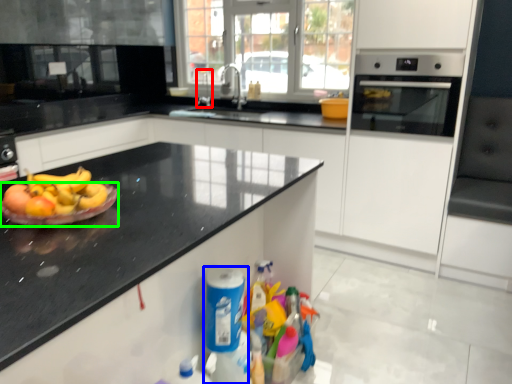
Question: Which object is positioned farthest from faucet (highlighted by a red box)? Select from cleaning product (highlighted by a blue box) and paper plate (highlighted by a green box).

Choices:
 (A) cleaning product
 (B) paper plate

Answer: (B)